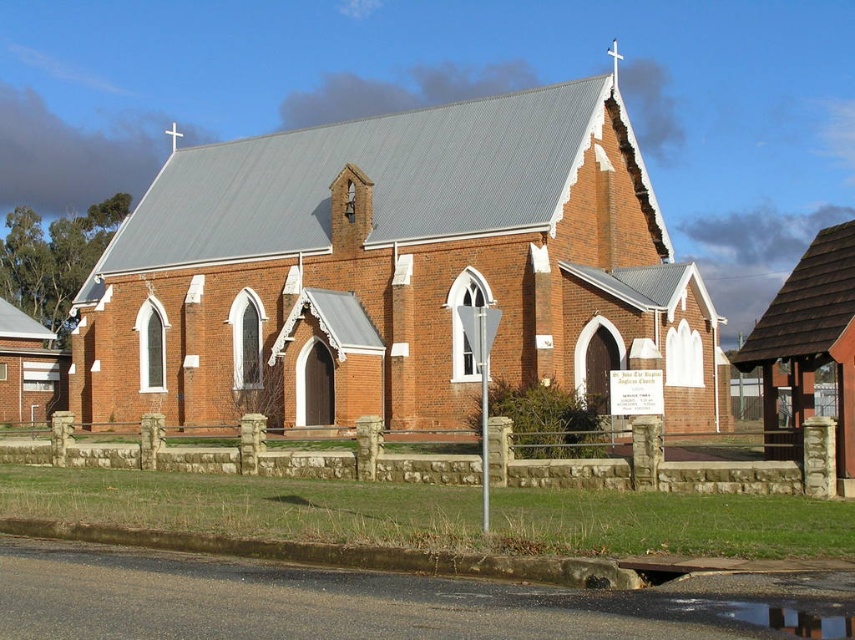
Question: Which point is closer to the camera taking this photo?

Choices:
 (A) (690, 602)
 (B) (634, 177)

Answer: (A)

Question: Can you confirm if red brick church at center is positioned above glossy concrete puddle at lower center?

Choices:
 (A) no
 (B) yes

Answer: (B)

Question: Is red brick church at center wider than glossy concrete puddle at lower center?

Choices:
 (A) yes
 (B) no

Answer: (A)

Question: Which point appears farthest from the camera in this image?

Choices:
 (A) (765, 627)
 (B) (105, 356)

Answer: (B)

Question: Which point is closer to the camera taking this photo?

Choices:
 (A) (765, 609)
 (B) (570, 348)

Answer: (A)

Question: Is red brick church at center positioned at the back of glossy concrete puddle at lower center?

Choices:
 (A) yes
 (B) no

Answer: (A)